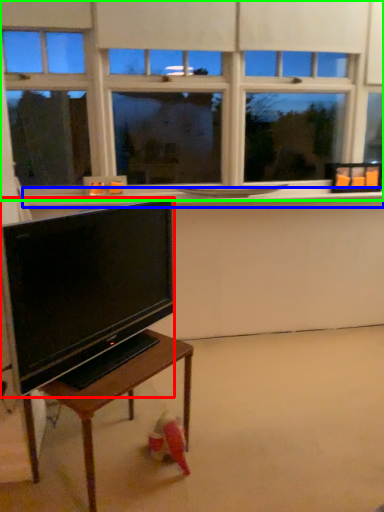
Question: Which is nearer to the television (highlighted by a red box)? window sill (highlighted by a blue box) or window (highlighted by a green box).

Choices:
 (A) window sill
 (B) window

Answer: (A)